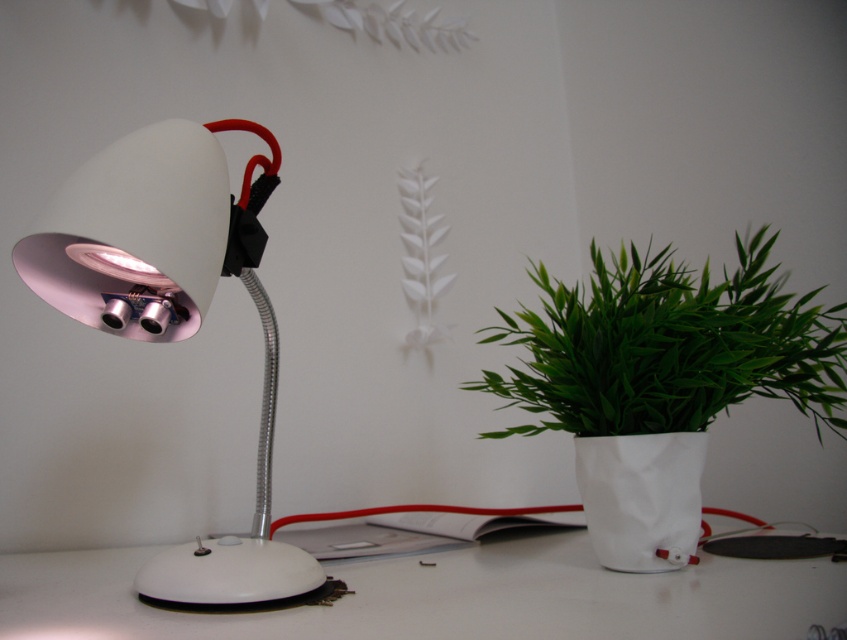
You are sitting at the desk and want to reach both the white glossy desk lamp at left and the green leafy plant at right. Which object will your hand touch first if you extend it straight forward?

The white glossy desk lamp at left is closer to the viewer than the green leafy plant at right, so your hand will touch the white glossy desk lamp at left first when extending it straight forward.

You are standing in front of the desk and want to place a small notebook on the desk. Where should you place it so that it doesn not block the light from the white glossy desk lamp at left?

Place the notebook away from the white glossy desk lamp at left to avoid blocking its light. The lamp is located at point (173, 308), so placing the notebook on the opposite side or further away would ensure the light remains unobstructed.